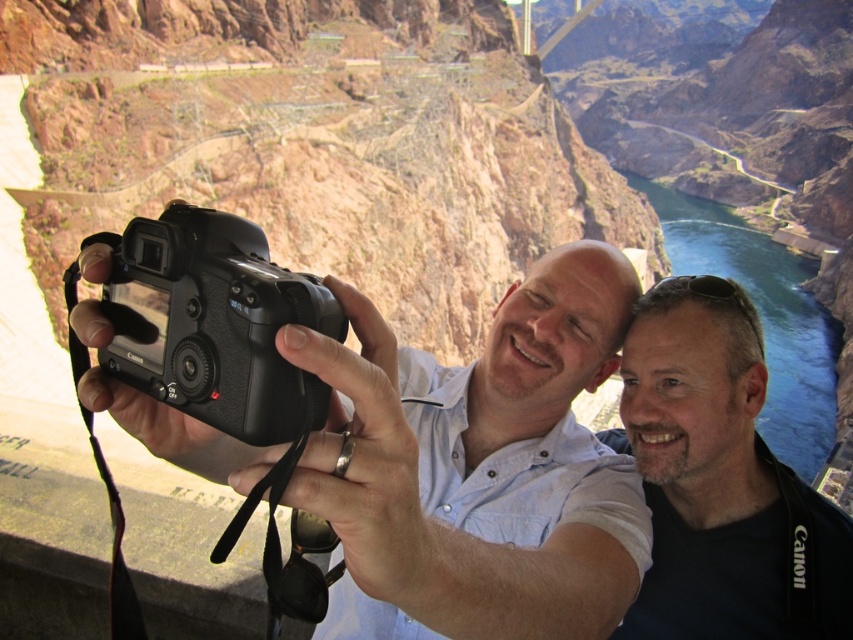
In the scene shown: You are a photographer trying to choose between two cameras to take a landscape photo of the canyon. The black matte camera at center and the black plastic camera at center are both available. Which camera should you choose if you want the one that is bigger?

The black matte camera at center is larger in size than the black plastic camera at center, so you should choose the black matte camera at center for a bigger option.